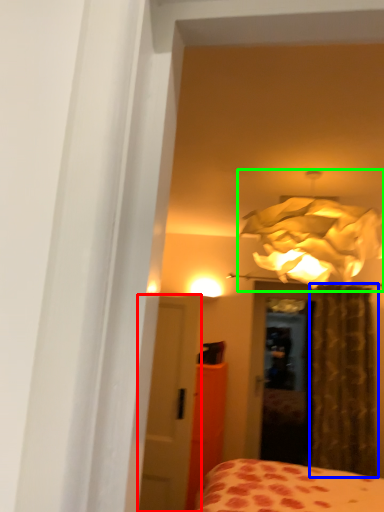
Question: Estimate the real-world distances between objects in this image. Which object is farther from door (highlighted by a red box), curtain (highlighted by a blue box) or lamp (highlighted by a green box)?

Choices:
 (A) curtain
 (B) lamp

Answer: (A)